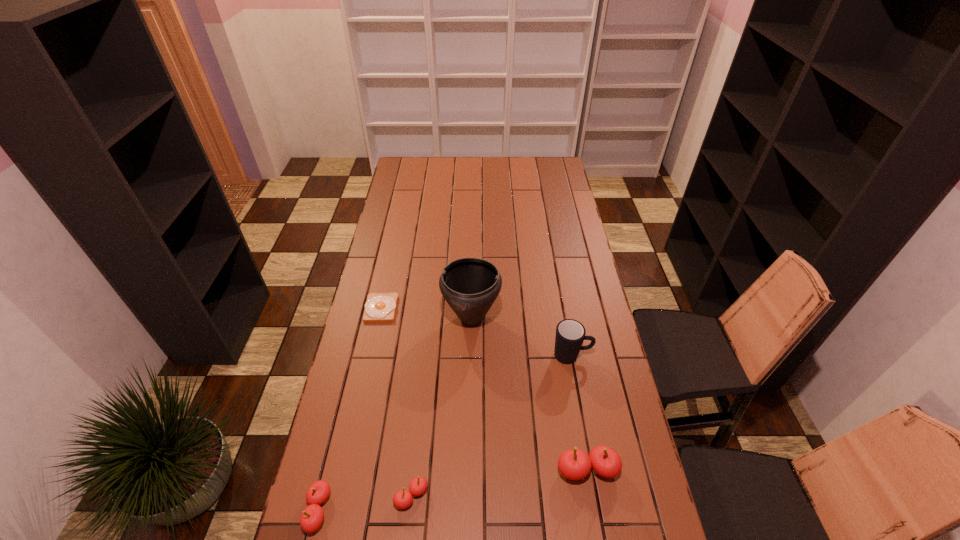
What are the coordinates of `the second shortest cherry` in the screenshot? It's located at (312, 516).

This screenshot has height=540, width=960. I want to click on the leftmost cherry, so click(x=312, y=516).

Find the location of a particular element. The height and width of the screenshot is (540, 960). the second shortest object is located at coordinates (402, 499).

Find the location of a particular element. the third object from left to right is located at coordinates (402, 499).

Image resolution: width=960 pixels, height=540 pixels. I want to click on the tallest cherry, so click(x=574, y=464).

Identify the location of toast. This screenshot has height=540, width=960. (380, 307).

Where is `mug`? The height and width of the screenshot is (540, 960). mug is located at coordinates (570, 334).

Where is `urn`? This screenshot has width=960, height=540. urn is located at coordinates (470, 286).

Where is `the third object from right to left`? The image size is (960, 540). the third object from right to left is located at coordinates (470, 286).

This screenshot has width=960, height=540. I want to click on free space located on the right of the leftmost cherry, so click(360, 510).